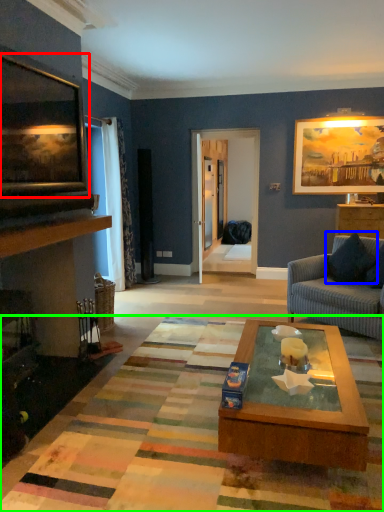
Question: Which object is positioned closest to picture frame (highlighted by a red box)? Select from pillow (highlighted by a blue box) and mat (highlighted by a green box).

Choices:
 (A) pillow
 (B) mat

Answer: (B)